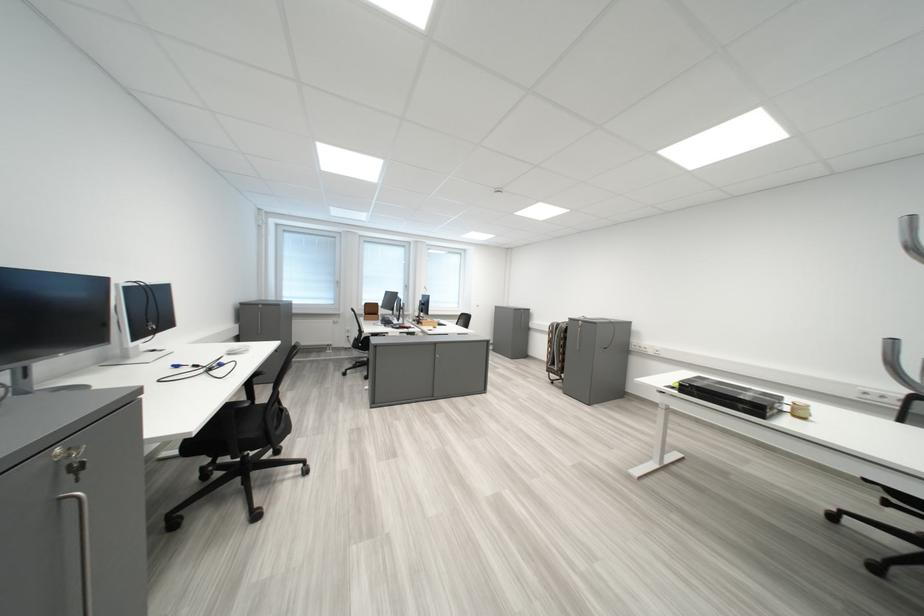
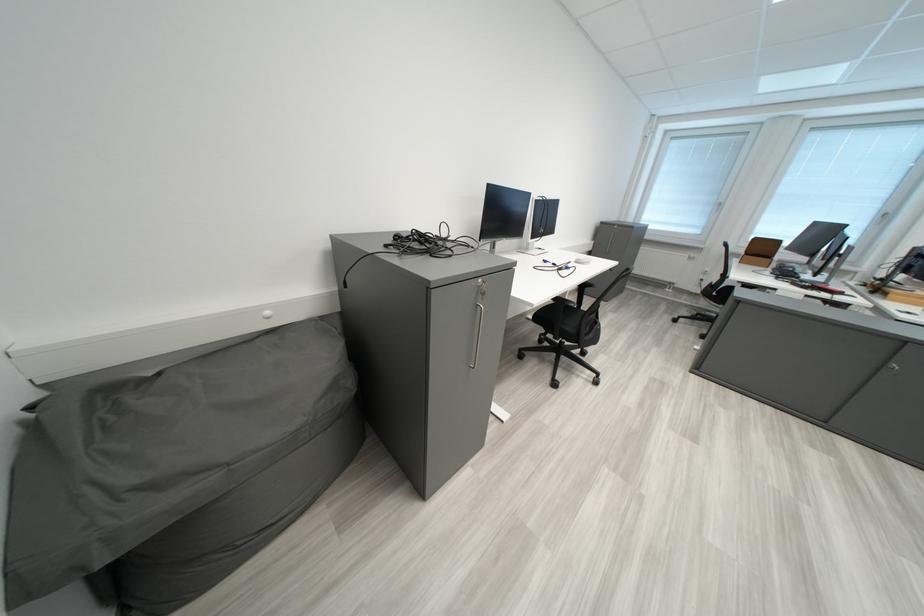
Question: I am providing you with two images of the same scene from different viewpoints. Which of the following objects are not visible in image2?

Choices:
 (A) brown cardboard box
 (B) black chair armrest
 (C) cabinet key
 (D) none of these

Answer: (D)